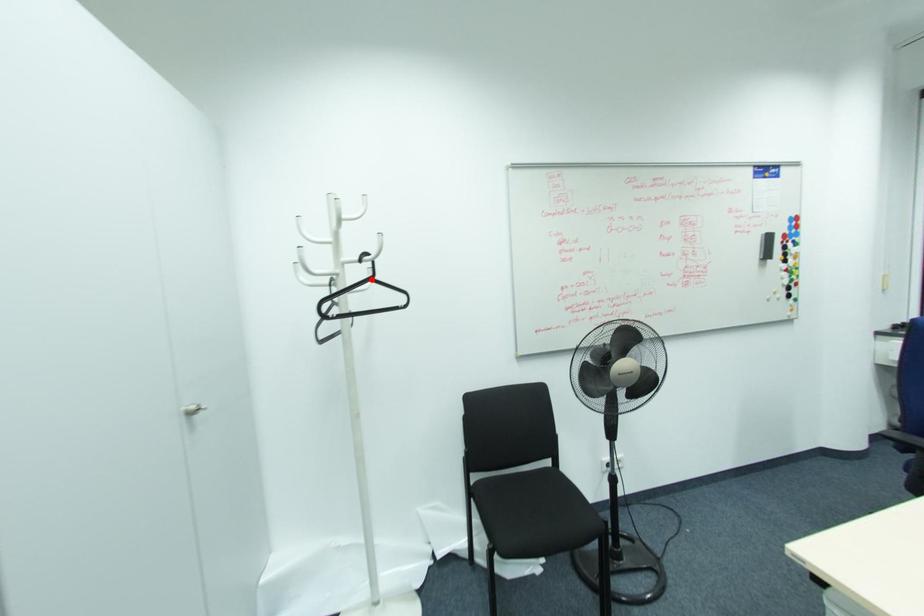
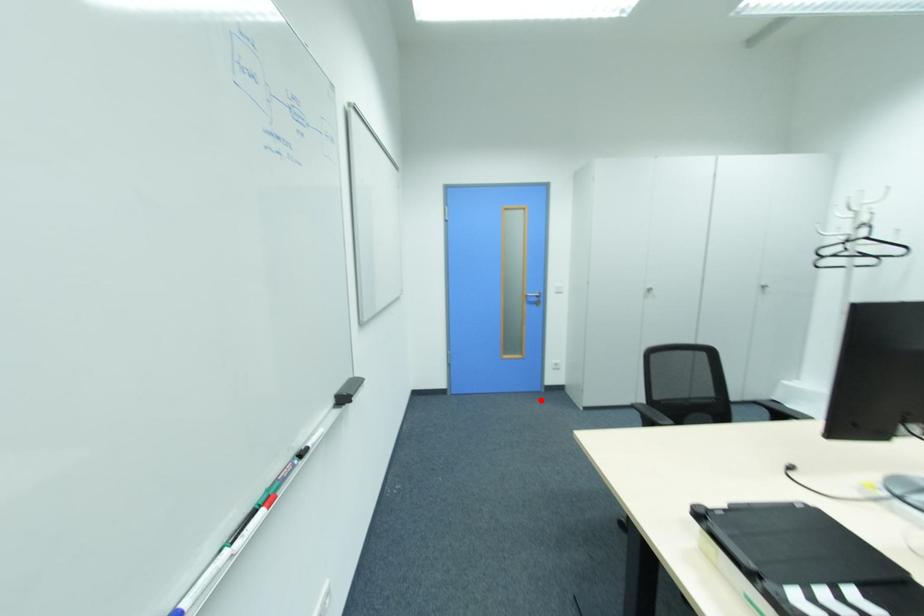
I am providing you with two images of the same scene from different viewpoints. A red point is marked on the first image and another point is marked on the second image. Does the point marked in image1 correspond to the same location as the one in image2?

No